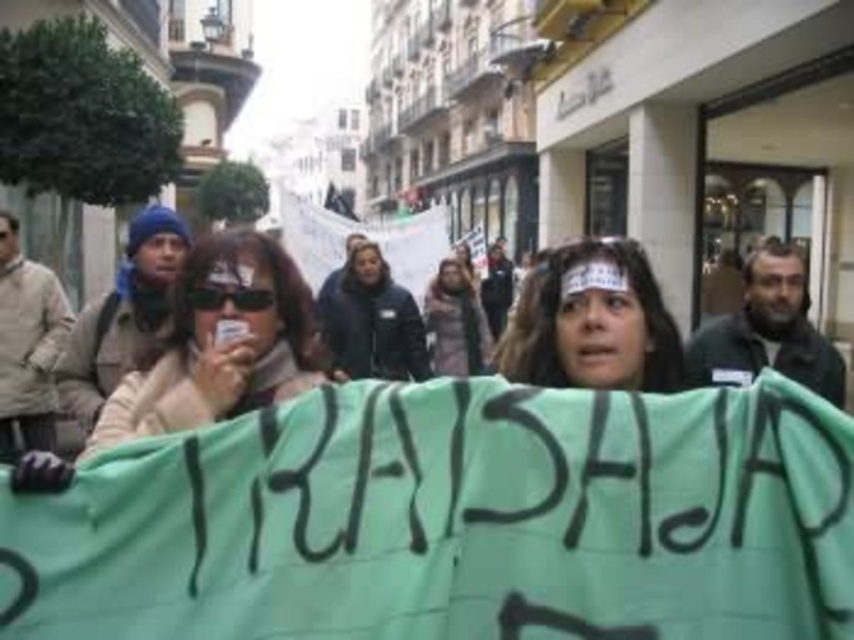
You are a photographer trying to capture a clear shot of the green fabric headband at center and the dark brown leather jacket at center. Based on their positions, which object should you focus on first to ensure both are in focus?

The green fabric headband at center is in front of the dark brown leather jacket at center, so you should focus on the green fabric headband at center first to ensure both are in focus.

You are a photographer standing at the center of the street. You want to take a photo of the green fabric headband at center and the other person holding the banner. How far apart are they in meters?

The green fabric headband at center and the other person holding the banner are 10.18 meters apart.

You are a photographer at the protest scene. You need to capture a photo where both the matte beige jacket at center and the dark brown leather jacket at center are visible. Which jacket should you focus on to ensure both are in frame without cropping?

The matte beige jacket at center is shorter than the dark brown leather jacket at center. Therefore, focusing on the dark brown leather jacket at center will ensure both jackets are visible in the frame since it is taller and can serve as a reference point.